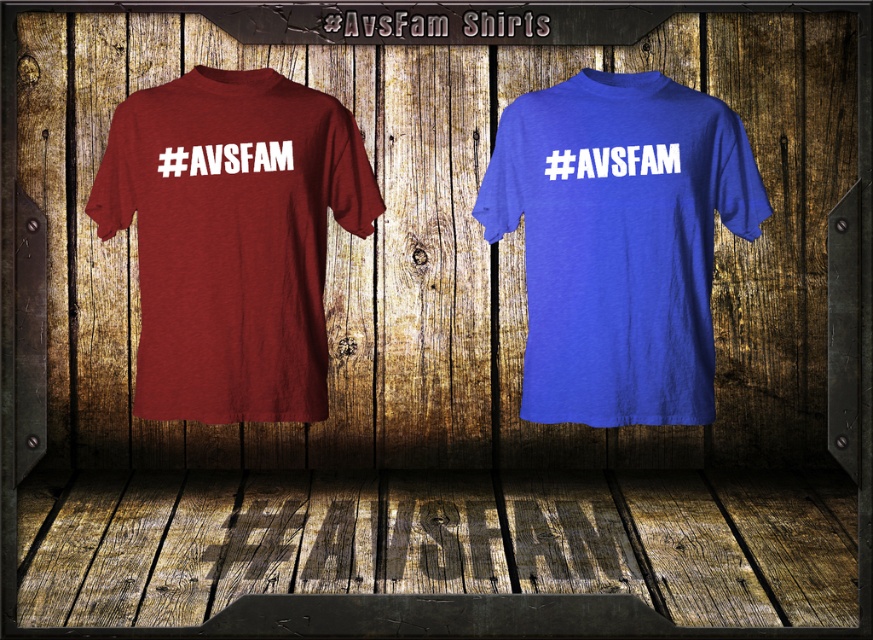
From the picture: Which of these two, maroon heather tee at left or royal blue t-shirt at right, stands taller?

With more height is royal blue t-shirt at right.

Is point (285, 182) less distant than point (600, 134)?

That is True.

Locate an element on the screen. maroon heather tee at left is located at coordinates (232, 237).